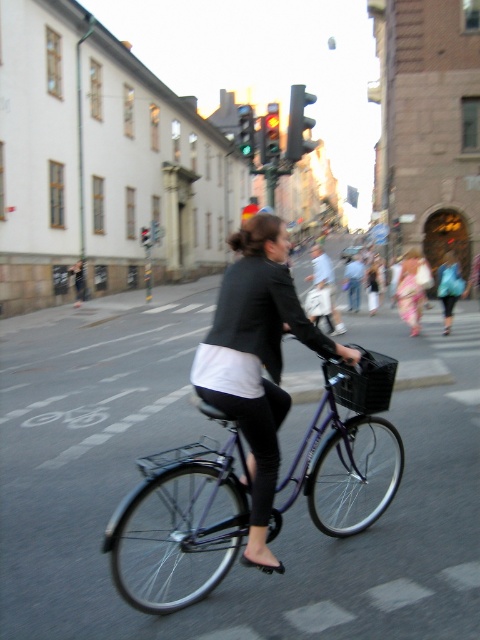
You are a delivery person planning to photograph the matte black jacket at center and the black plastic traffic light at upper center for a client. The client wants to know which object takes up more visual space in the image. Based on the scene, which one should you report as larger?

The black plastic traffic light at upper center takes up more visual space in the image than the matte black jacket at center because the matte black jacket at center occupies less space than black plastic traffic light at upper center.

You are a city planner analyzing traffic flow. You observe the metallic purple bicycle at center in the scene. What are its coordinates?

The metallic purple bicycle at center is located at coordinates point (x=179, y=524).

You are a pedestrian trying to cross the street. You see the matte black jacket at center and the black plastic traffic light at upper center. Which object is closer to the ground?

The matte black jacket at center is positioned under the black plastic traffic light at upper center, so the matte black jacket at center is closer to the ground.